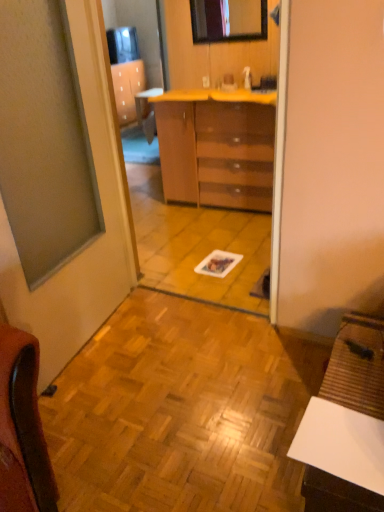
Question: From their relative heights in the image, would you say matte glass window at left is taller or shorter than yellow laminate counter at center?

Choices:
 (A) tall
 (B) short

Answer: (A)

Question: Which is correct: matte glass window at left is inside yellow laminate counter at center, or outside of it?

Choices:
 (A) inside
 (B) outside

Answer: (B)

Question: Which object is positioned closest to the white matte desk at lower right?

Choices:
 (A) yellow laminate counter at center
 (B) wooden parquet floor at center
 (C) glossy wooden mirror at upper center
 (D) glossy brown chest of drawers at center
 (E) matte glass window at left

Answer: (B)

Question: Based on their relative distances, which object is nearer to the matte glass window at left?

Choices:
 (A) yellow laminate counter at center
 (B) glossy brown chest of drawers at center
 (C) white matte desk at lower right
 (D) glossy wooden mirror at upper center
 (E) wooden parquet floor at center

Answer: (E)